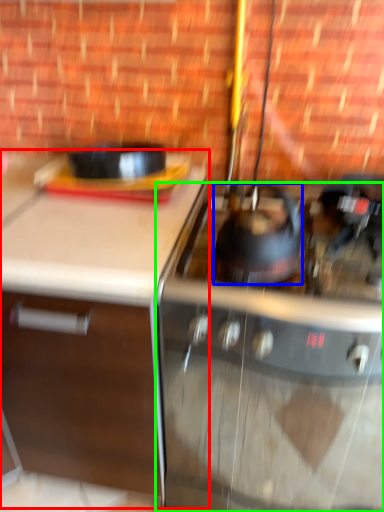
Question: Which object is positioned farthest from cabinetry (highlighted by a red box)? Select from kitchen appliance (highlighted by a blue box) and gas stove (highlighted by a green box).

Choices:
 (A) kitchen appliance
 (B) gas stove

Answer: (A)